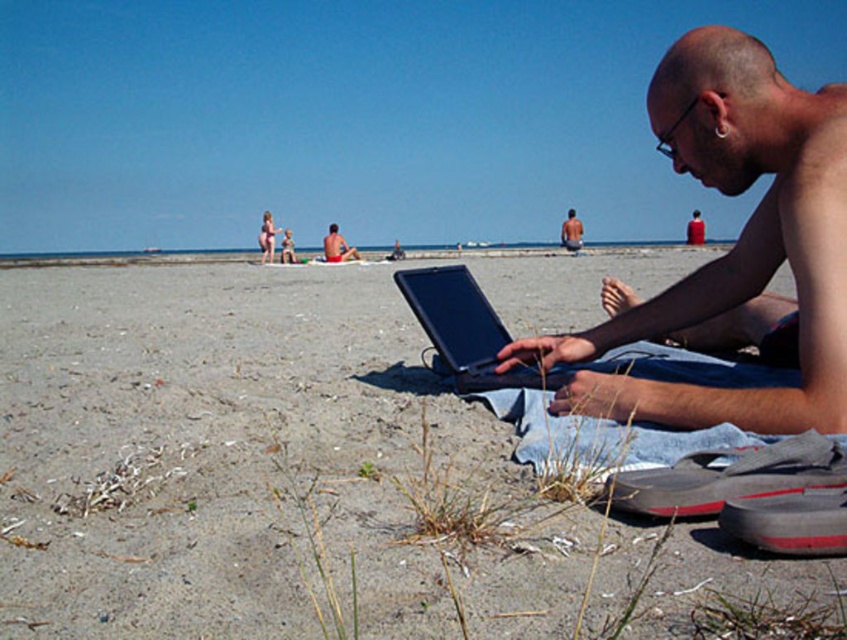
Does gray sand at lower center appear over red swim trunks at center?

Incorrect, gray sand at lower center is not positioned above red swim trunks at center.

Where is `gray sand at lower center`? gray sand at lower center is located at coordinates (216, 449).

The width and height of the screenshot is (847, 640). What are the coordinates of `gray sand at lower center` in the screenshot? It's located at (216, 449).

From the picture: Does smooth skin man at center appear over shiny black laptop at lower right?

Actually, smooth skin man at center is below shiny black laptop at lower right.

Consider the image. Can you confirm if smooth skin man at center is bigger than shiny black laptop at lower right?

Correct, smooth skin man at center is larger in size than shiny black laptop at lower right.

Does point (576, 221) come in front of point (704, 227)?

Yes, it is in front of point (704, 227).

Find the location of a particular element. smooth skin man at center is located at coordinates (571, 230).

Is shiny black laptop at center shorter than black matte laptop at center?

No.

Does shiny black laptop at center have a smaller size compared to black matte laptop at center?

No, shiny black laptop at center is not smaller than black matte laptop at center.

Is point (613, 397) behind point (501, 387)?

No, it is in front of (501, 387).

Where is `shiny black laptop at center`? Image resolution: width=847 pixels, height=640 pixels. shiny black laptop at center is located at coordinates (734, 248).